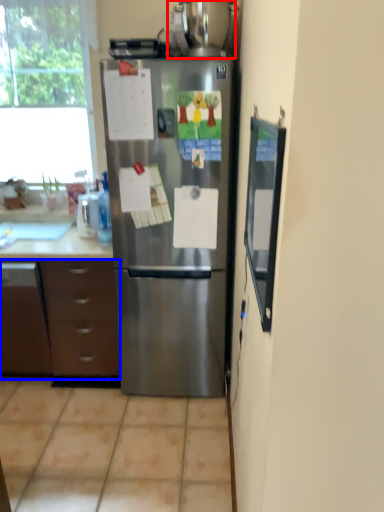
Question: Which point is further to the camera, appliance (highlighted by a red box) or cabinetry (highlighted by a blue box)?

Choices:
 (A) appliance
 (B) cabinetry

Answer: (B)